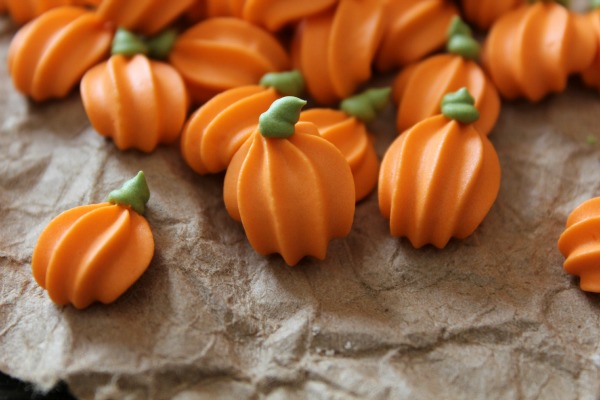
This screenshot has width=600, height=400. I want to click on plate, so click(x=343, y=353).